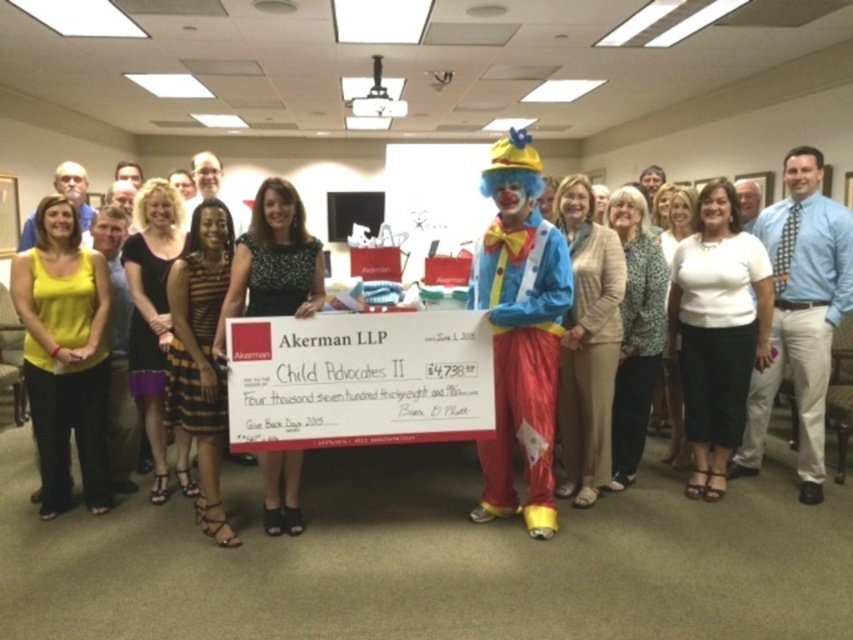
Question: Is yellow fabric tank top at center smaller than blue tie at center?

Choices:
 (A) no
 (B) yes

Answer: (B)

Question: Does blue tie at center appear over matte black dress at center?

Choices:
 (A) yes
 (B) no

Answer: (B)

Question: Which of the following is the closest to the observer?

Choices:
 (A) yellow fabric tank top at center
 (B) blue tie at center
 (C) matte black dress at center

Answer: (C)

Question: Which object is closer to the camera taking this photo?

Choices:
 (A) matte black dress at center
 (B) yellow fabric tank top at center
 (C) blue tie at center

Answer: (A)

Question: Which point is closer to the camera?

Choices:
 (A) (802, 205)
 (B) (706, 358)
 (C) (526, 356)
 (D) (26, 300)

Answer: (C)

Question: Is the position of white matte blouse at center more distant than that of blue tie at center?

Choices:
 (A) yes
 (B) no

Answer: (B)